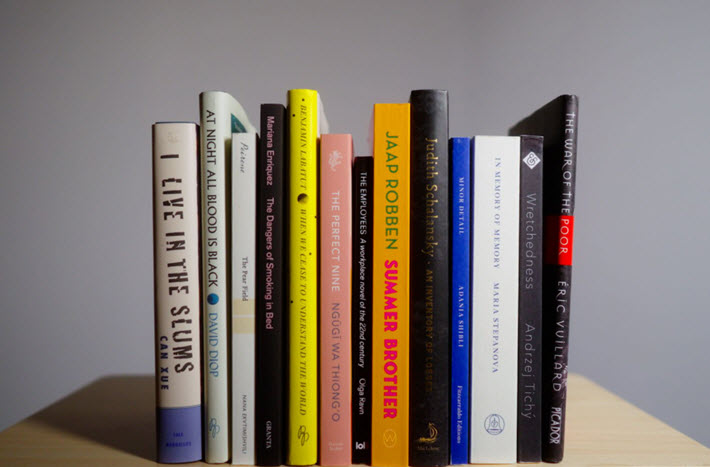
Identify the location of white books. This screenshot has height=467, width=710. (167, 253), (211, 241), (234, 236), (486, 228).